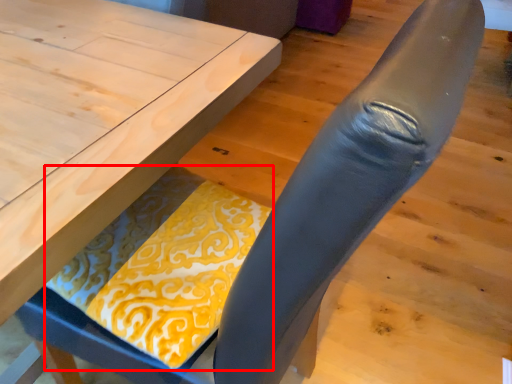
Question: From the image's perspective, where is blanket (annotated by the red box) located relative to table?

Choices:
 (A) above
 (B) below

Answer: (B)